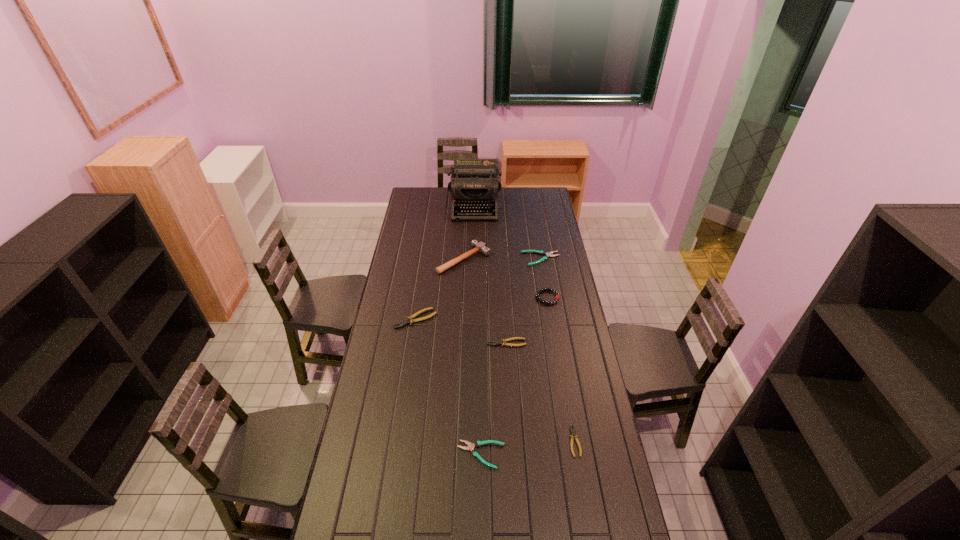
Where is `free space located 0.150m on the right of the third nearest pliers`? free space located 0.150m on the right of the third nearest pliers is located at coordinates (560, 343).

Locate an element on the screen. vacant region located on the front of the smaller teal pliers is located at coordinates (481, 523).

I want to click on vacant area located on the front of the nearest yellow pliers, so click(x=585, y=502).

This screenshot has width=960, height=540. Find the location of `object that is at the far edge`. object that is at the far edge is located at coordinates 474,184.

You are a GUI agent. You are given a task and a screenshot of the screen. Output one action in this format:
    pyautogui.click(x=<x>, y=<y>)
    Task: Click on the object that is positioned at the left edge
    Image resolution: width=960 pixels, height=540 pixels.
    Given the screenshot: What is the action you would take?
    pyautogui.click(x=410, y=319)

Find the location of a particular element. Image resolution: width=960 pixels, height=540 pixels. bracelet that is at the right edge is located at coordinates (540, 291).

In the image, there is a desktop. Where is `vacant space at the left edge`? vacant space at the left edge is located at coordinates (417, 296).

In the image, there is a desktop. Identify the location of vacant space at the right edge. (559, 311).

The width and height of the screenshot is (960, 540). In order to click on vacant space at the far right corner of the desktop in this screenshot , I will do `click(538, 198)`.

Identify the location of unoccupied position between the sixth shortest object and the hammer. This screenshot has height=540, width=960. pos(506,278).